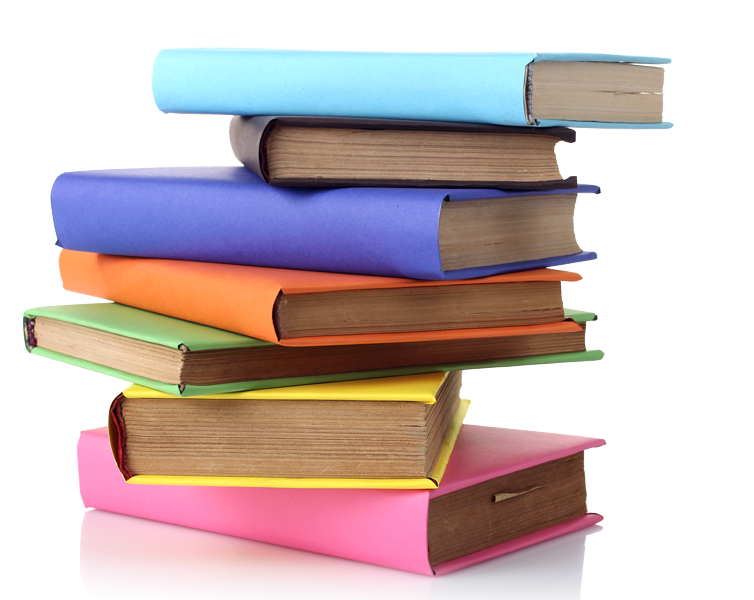
The width and height of the screenshot is (754, 600). Identify the location of books. (483, 481), (366, 400), (201, 370), (353, 325), (466, 247), (443, 135), (449, 88).